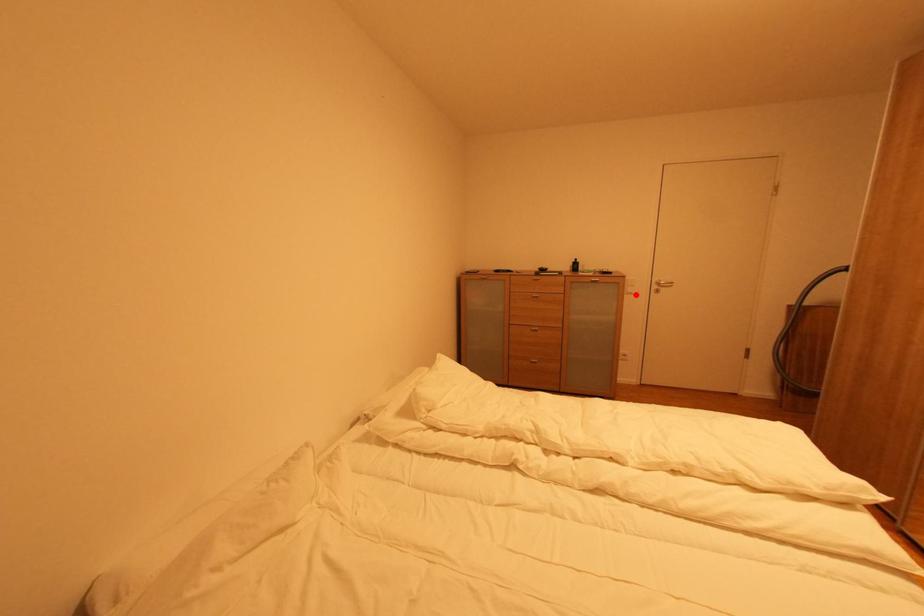
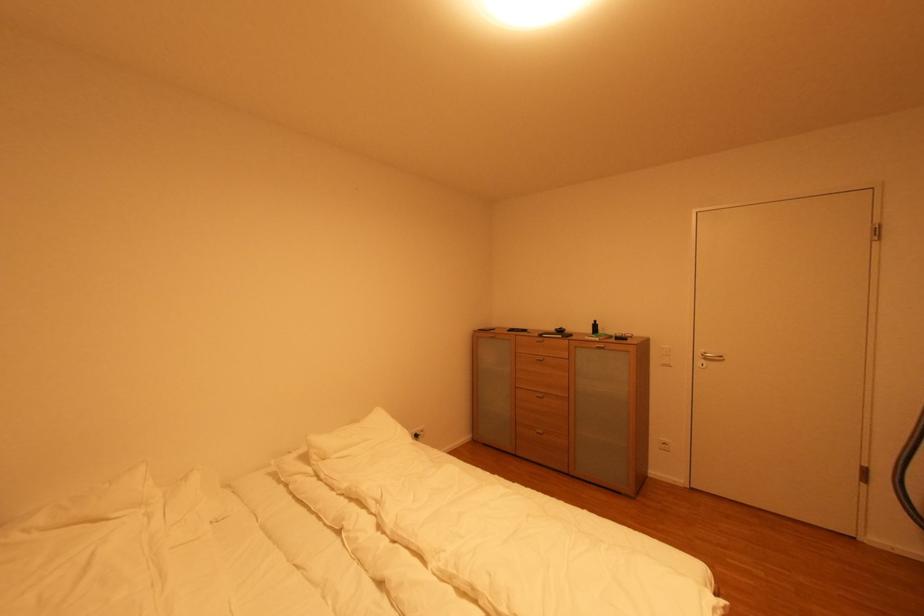
In the second image, find the point that corresponds to the highlighted location in the first image.

(670, 367)